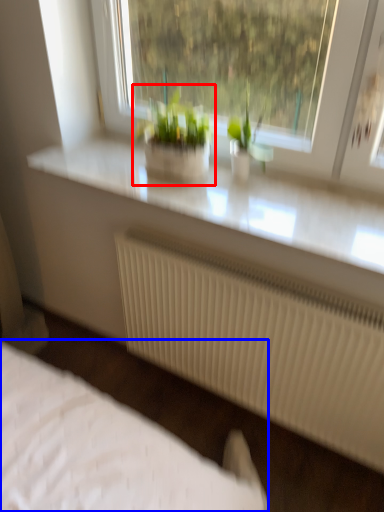
Question: Among these objects, which one is farthest to the camera, houseplant (highlighted by a red box) or bed (highlighted by a blue box)?

Choices:
 (A) houseplant
 (B) bed

Answer: (B)